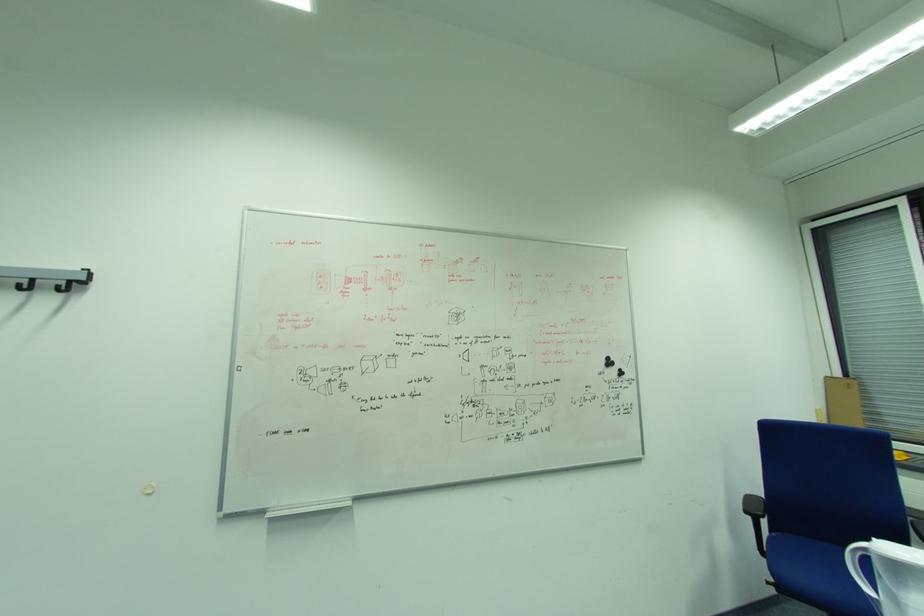
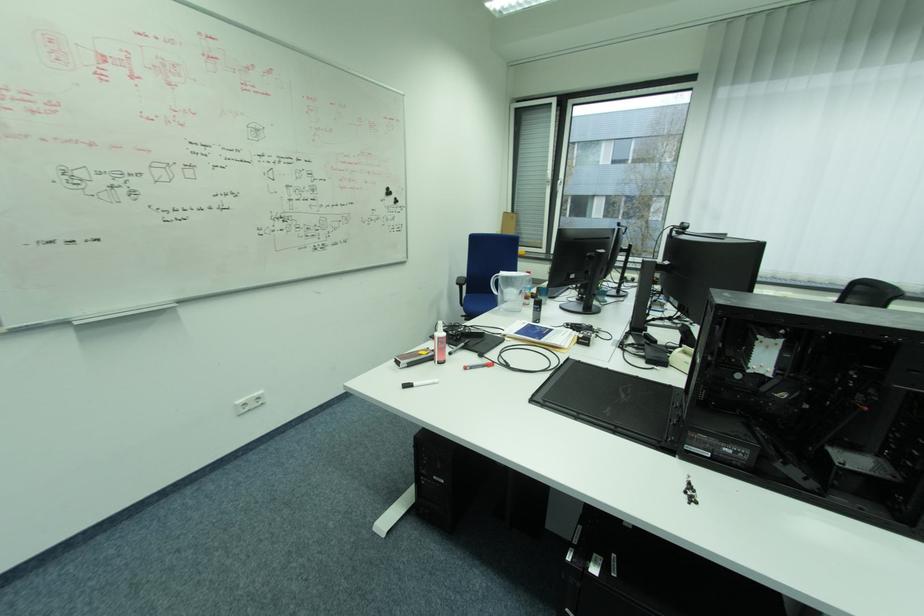
Based on the continuous images, in which direction is the camera rotating?

The camera's rotation is toward right-down.